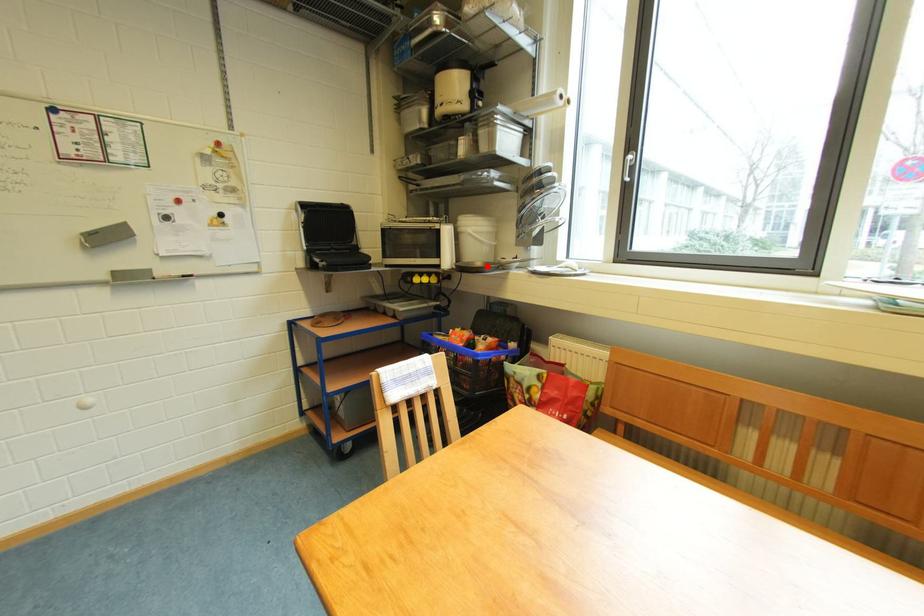
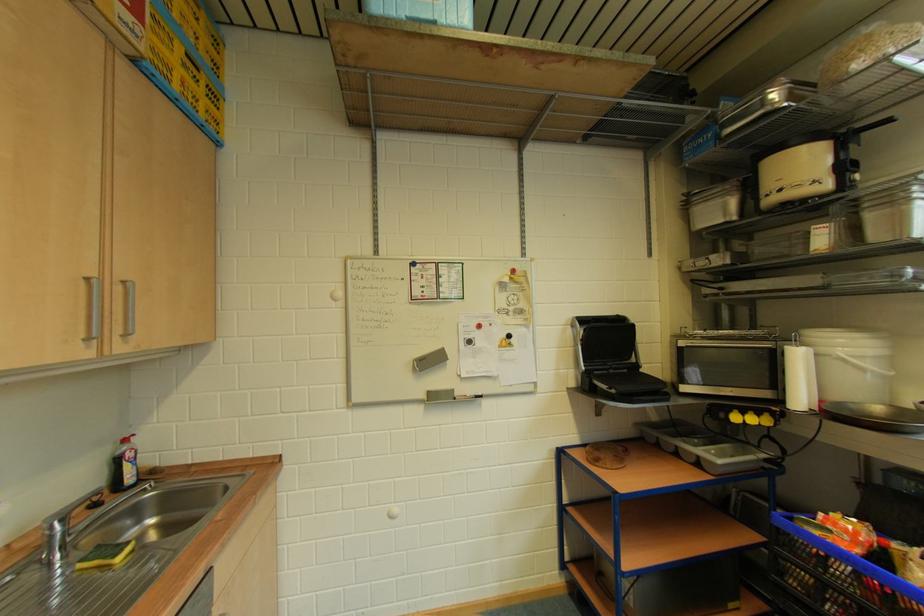
Locate, in the second image, the point that corresponds to the highlighted location in the first image.

(884, 411)